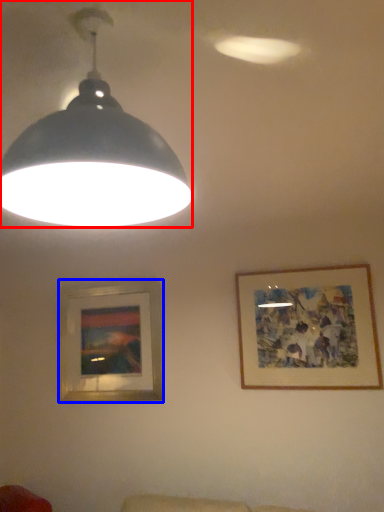
Question: Which point is closer to the camera, lamp (highlighted by a red box) or picture frame (highlighted by a blue box)?

Choices:
 (A) lamp
 (B) picture frame

Answer: (A)